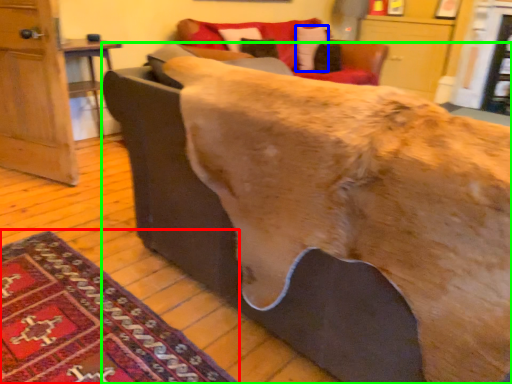
Question: Which object is the closest to the mat (highlighted by a red box)? Choose among these: pillow (highlighted by a blue box) or furniture (highlighted by a green box).

Choices:
 (A) pillow
 (B) furniture

Answer: (B)